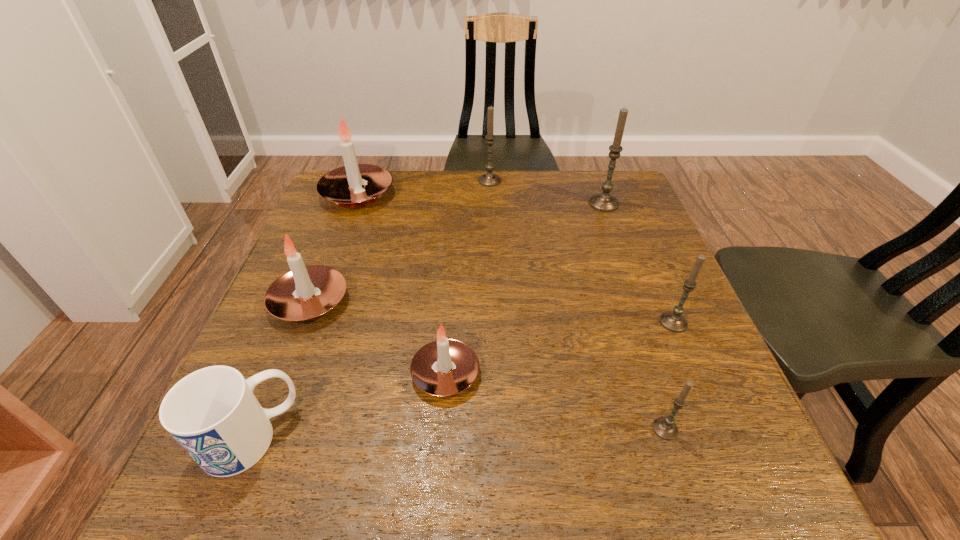
At what (x,y) coordinates should I click in order to perform the action: click on the tallest object. Please return your answer as a coordinate pair (x, y). Looking at the image, I should click on (604, 201).

Locate an element on the screen. The image size is (960, 540). the third nearest gray candle is located at coordinates 604,201.

You are a GUI agent. You are given a task and a screenshot of the screen. Output one action in this format:
    pyautogui.click(x=<x>, y=<y>)
    Task: Click on the leftmost gray candle
    
    Given the screenshot: What is the action you would take?
    pyautogui.click(x=488, y=179)

Identify the location of the second biggest gray candle. The width and height of the screenshot is (960, 540). (488, 179).

The width and height of the screenshot is (960, 540). Find the location of `the farthest white candle`. the farthest white candle is located at coordinates (344, 185).

At what (x,y) coordinates should I click in order to perform the action: click on the second nearest white candle. Please return your answer as a coordinate pair (x, y). Looking at the image, I should click on (304, 293).

Where is `the second nearest gray candle`? This screenshot has height=540, width=960. the second nearest gray candle is located at coordinates (673, 320).

Image resolution: width=960 pixels, height=540 pixels. What are the coordinates of `the rightmost white candle` in the screenshot? It's located at (444, 367).

The width and height of the screenshot is (960, 540). In order to click on the smallest white candle in this screenshot , I will do `click(444, 367)`.

Identify the location of the nearest gray candle. (665, 427).